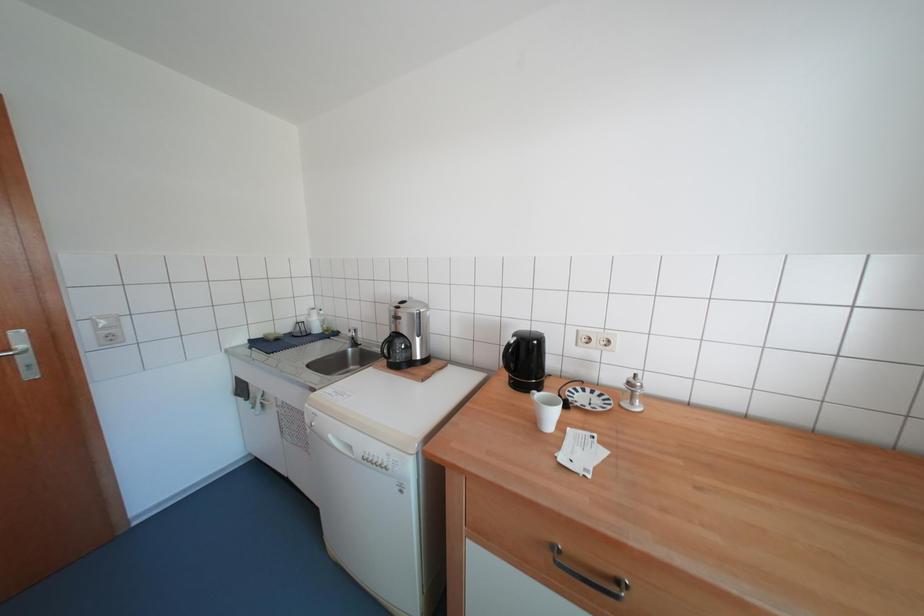
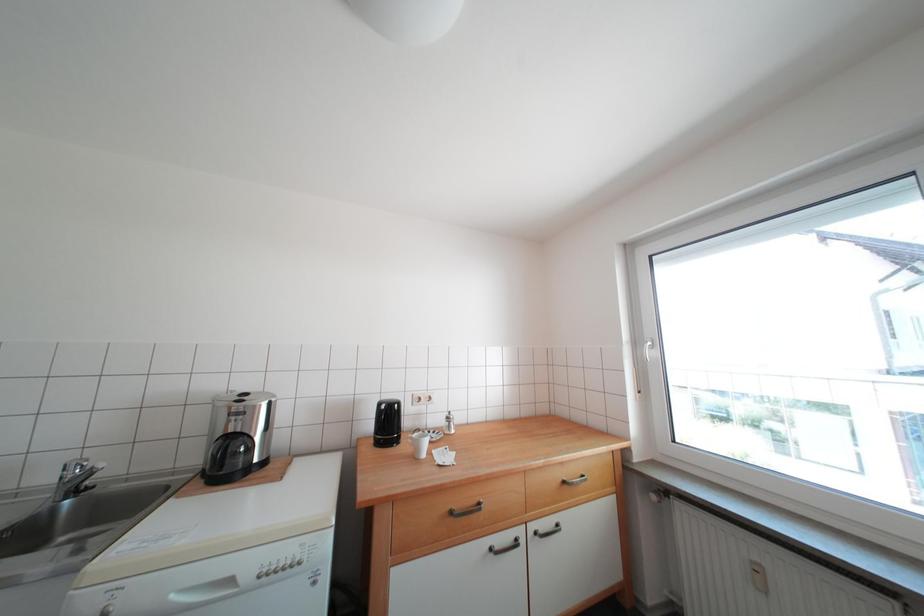
Based on the continuous images, in which direction is the camera rotating?

The camera's rotation is toward right-up.